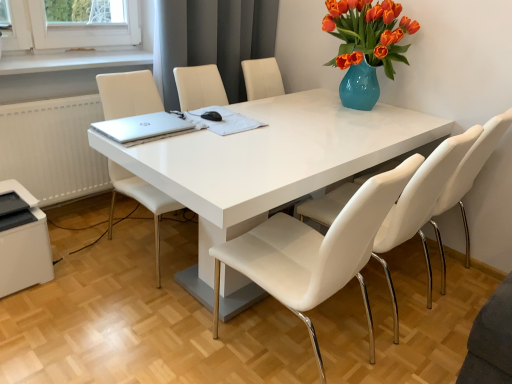
Question: Is white leather chair at center, which ranks as the second chair in left-to-right order, inside or outside of white plastic printer at lower left?

Choices:
 (A) outside
 (B) inside

Answer: (A)

Question: From the image's perspective, relative to white plastic printer at lower left, is white leather chair at center, which is the 2th chair from right to left, above or below?

Choices:
 (A) below
 (B) above

Answer: (A)

Question: Which of these objects is positioned closest to the silver metallic laptop at center?

Choices:
 (A) white leather chair at center, which is the 2th chair from right to left
 (B) white leather chair at right, the 3th chair in the left-to-right sequence
 (C) white plastic printer at lower left
 (D) gray fabric curtain at upper center
 (E) white leather chair at center, which is the 1th chair in left-to-right order

Answer: (E)

Question: Which object is positioned farthest from the white plastic printer at lower left?

Choices:
 (A) silver metallic laptop at center
 (B) white glossy table at center
 (C) white leather chair at center, acting as the third chair starting from the right
 (D) white leather chair at right, the 3th chair in the left-to-right sequence
 (E) white leather chair at center, which ranks as the second chair in left-to-right order

Answer: (D)